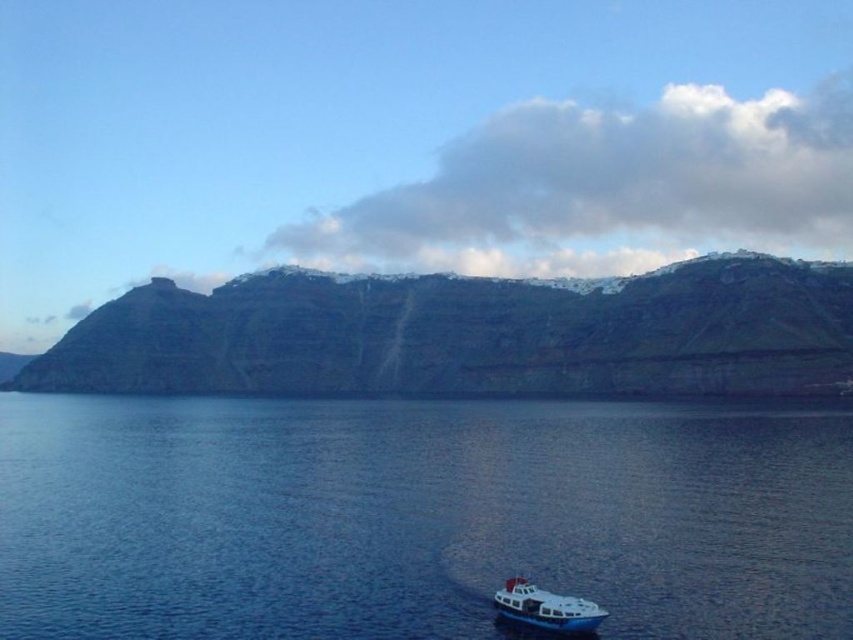
Question: Is blue liquid water at lower center behind white glossy boat at lower left?

Choices:
 (A) yes
 (B) no

Answer: (B)

Question: Among these points, which one is nearest to the camera?

Choices:
 (A) (531, 529)
 (B) (496, 596)

Answer: (B)

Question: Which of the following is the closest to the observer?

Choices:
 (A) pos(817,282)
 (B) pos(596,621)
 (C) pos(630,476)

Answer: (B)

Question: Which of the following is the farthest from the observer?

Choices:
 (A) (486, 557)
 (B) (401, 362)

Answer: (B)

Question: Does rugged stone cliff at upper center have a larger size compared to white glossy boat at lower left?

Choices:
 (A) no
 (B) yes

Answer: (B)

Question: Does blue liquid water at lower center appear under rugged stone cliff at upper center?

Choices:
 (A) no
 (B) yes

Answer: (B)